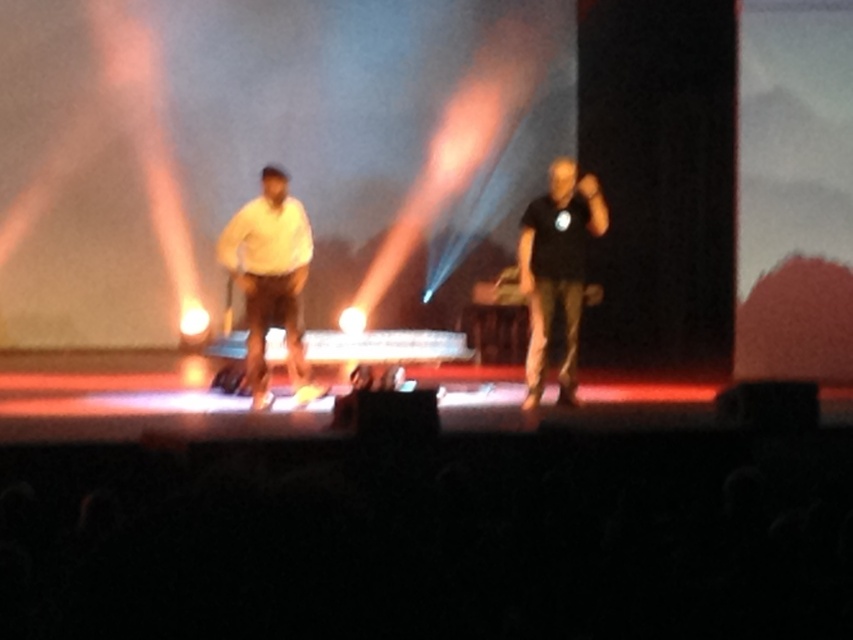
Who is shorter, white matte shirt at center or black matte shirt at center?

Standing shorter between the two is white matte shirt at center.

Can you confirm if white matte shirt at center is shorter than black matte shirt at center?

Correct, white matte shirt at center is not as tall as black matte shirt at center.

In order to click on white matte shirt at center in this screenshot , I will do `click(271, 280)`.

Find the location of a particular element. white matte shirt at center is located at coordinates (271, 280).